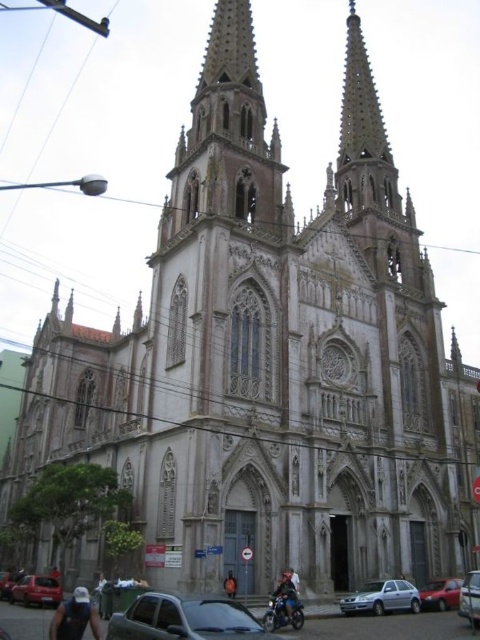
You are standing at point A, which is at point (94, 625). You need to walk to point B, which is 42.21 meters away. Given the church and urban setting, is there any obstruction between you and point B that might block your path?

The distance between point A at (94, 625) and point B is 42.21 meters. However, the scene includes a grand Gothic church with two spires and parked cars in an urban setting. These structures and vehicles could potentially obstruct the path between the two points, so there might be obstructions.

Looking at this image, you are a delivery person standing in front of the grand Gothic church. You need to park your delivery van, which is 2 meters wide, between the metallic silver car at center and the blue denim jeans at lower center. Can you fit your van in the space between them?

The metallic silver car at center might be wider than blue denim jeans at lower center, so it is uncertain if there is enough space for the delivery van. The van driver should measure the distance first before attempting to park.